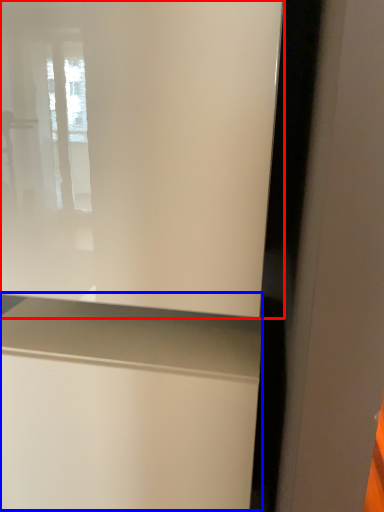
Question: Which point is further to the camera, window (highlighted by a red box) or vanity (highlighted by a blue box)?

Choices:
 (A) window
 (B) vanity

Answer: (B)